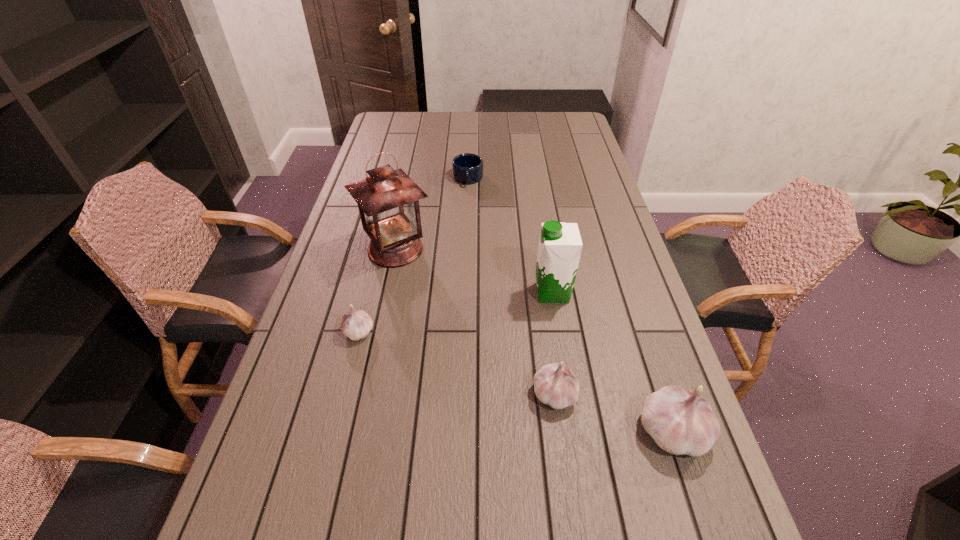
To ensure equal spacing by inserting another garlic among them, please point out a vacant spot for this new garlic. Please provide its 2D coordinates. Your answer should be formatted as a tuple, i.e. [(x, y)], where the tuple contains the x and y coordinates of a point satisfying the conditions above.

[(450, 361)]